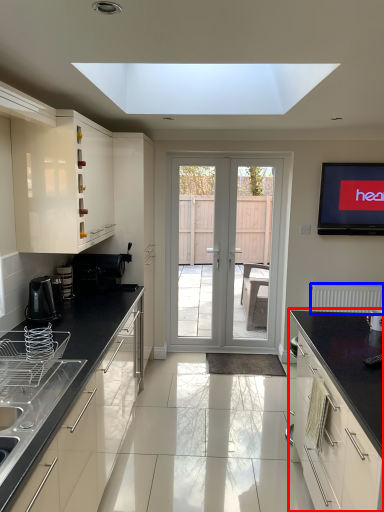
Question: Which of the following is the closest to the observer, cabinetry (highlighted by a red box) or radiator (highlighted by a blue box)?

Choices:
 (A) cabinetry
 (B) radiator

Answer: (A)